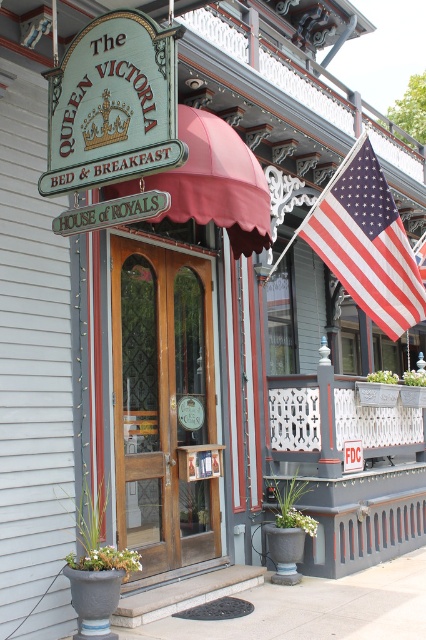
Question: Based on their relative distances, which object is nearer to the white painted wood porch at lower right?

Choices:
 (A) american flag at upper right
 (B) mahogany wood door at center
 (C) green painted wood sign at upper left

Answer: (A)

Question: Does mahogany wood door at center appear on the left side of green painted wood sign at upper left?

Choices:
 (A) yes
 (B) no

Answer: (B)

Question: Does mahogany wood door at center have a greater width compared to white painted wood porch at lower right?

Choices:
 (A) yes
 (B) no

Answer: (B)

Question: Which object appears closest to the camera in this image?

Choices:
 (A) mahogany wood door at center
 (B) green painted wood sign at upper left
 (C) american flag at upper right
 (D) white painted wood porch at lower right

Answer: (B)

Question: Can you confirm if mahogany wood door at center is smaller than white painted wood porch at lower right?

Choices:
 (A) no
 (B) yes

Answer: (B)

Question: Which of these objects is positioned closest to the mahogany wood door at center?

Choices:
 (A) white painted wood porch at lower right
 (B) green painted wood sign at upper left

Answer: (A)